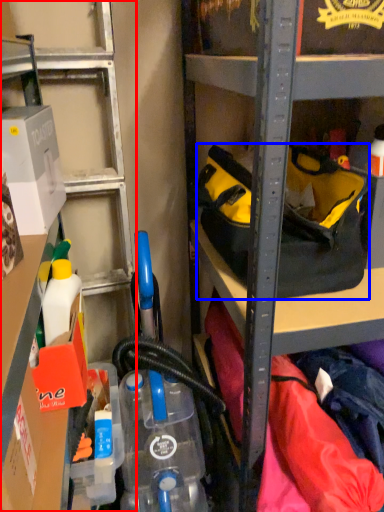
Question: Which point is further to the camera, shelf (highlighted by a red box) or handbag (highlighted by a blue box)?

Choices:
 (A) shelf
 (B) handbag

Answer: (B)